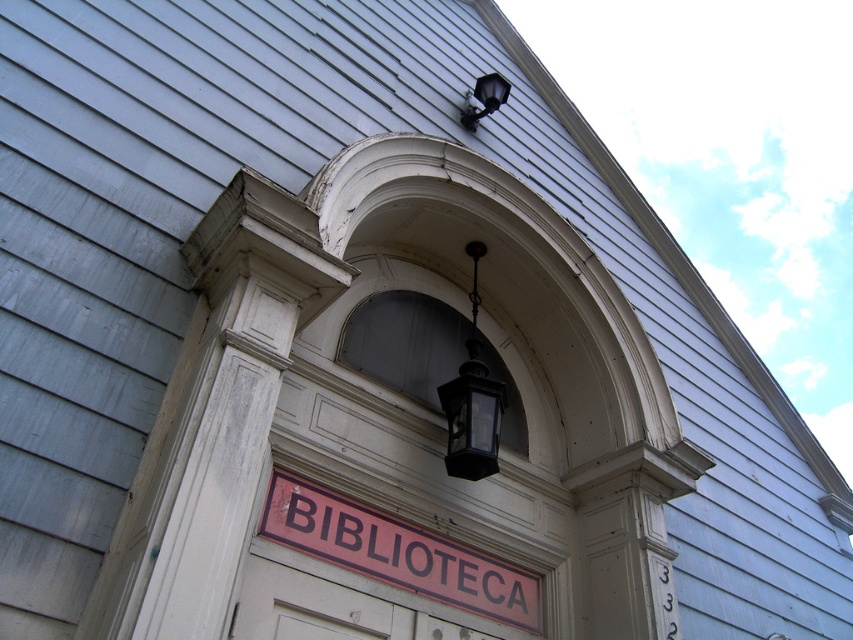
Can you confirm if red matte sign at center is positioned above black glass lamp at upper center?

No, red matte sign at center is not above black glass lamp at upper center.

Does point (463, 557) lie in front of point (490, 92)?

That is True.

What do you see at coordinates (397, 552) in the screenshot? I see `red matte sign at center` at bounding box center [397, 552].

At what (x,y) coordinates should I click in order to perform the action: click on red matte sign at center. Please return your answer as a coordinate pair (x, y). This screenshot has width=853, height=640. Looking at the image, I should click on 397,552.

Locate an element on the screen. This screenshot has width=853, height=640. red matte sign at center is located at coordinates (397, 552).

Which is behind, point (331, 520) or point (238, 628)?

Positioned behind is point (331, 520).

Does point (397, 550) lie behind point (434, 616)?

Yes, point (397, 550) is farther from viewer.

You are a GUI agent. You are given a task and a screenshot of the screen. Output one action in this format:
    pyautogui.click(x=<x>, y=<y>)
    Task: Click on the red matte sign at center
    The image size is (853, 640).
    Given the screenshot: What is the action you would take?
    pyautogui.click(x=397, y=552)

Is white wooden door at center above black glass lamp at upper center?

No, white wooden door at center is not above black glass lamp at upper center.

How distant is white wooden door at center from black glass lamp at upper center?

white wooden door at center is 3.81 meters away from black glass lamp at upper center.

Which is behind, point (247, 614) or point (469, 109)?

The point (469, 109) is more distant.

The width and height of the screenshot is (853, 640). I want to click on white wooden door at center, so click(331, 609).